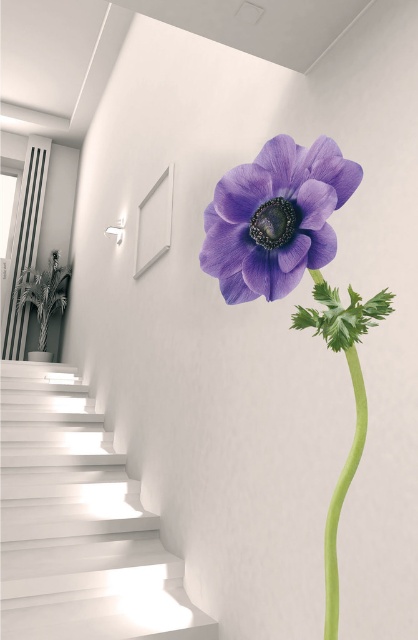
Which is more to the left, green smooth stem at center or green leafy plant at left?

Positioned to the left is green leafy plant at left.

From the picture: Does green smooth stem at center lie in front of green leafy plant at left?

Yes, it is in front of green leafy plant at left.

Does point (325, 605) come in front of point (53, 259)?

Yes.

You are a GUI agent. You are given a task and a screenshot of the screen. Output one action in this format:
    pyautogui.click(x=<x>, y=<y>)
    Task: Click on the green smooth stem at center
    The image size is (418, 640).
    Given the screenshot: What is the action you would take?
    pyautogui.click(x=343, y=497)

Who is lower down, matte purple flower at center or green smooth stem at center?

green smooth stem at center

Does point (259, 269) come in front of point (329, 624)?

No, it is behind (329, 624).

Between point (310, 268) and point (325, 611), which one is positioned behind?

Positioned behind is point (325, 611).

I want to click on matte purple flower at center, so click(275, 218).

Who is positioned more to the left, white smooth stairs at lower left or green smooth stem at center?

From the viewer's perspective, white smooth stairs at lower left appears more on the left side.

Is white smooth stairs at lower left wider than green smooth stem at center?

Yes.

Does point (66, 611) come in front of point (326, 566)?

That is False.

The width and height of the screenshot is (418, 640). Identify the location of white smooth stairs at lower left. (78, 524).